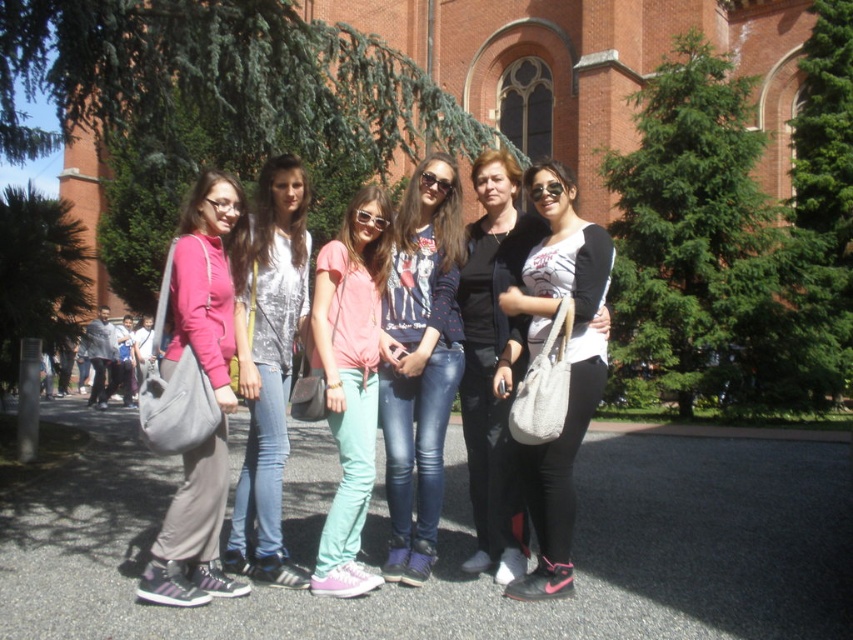
Is matte pink hoodie at left to the left of shiny silver top at center from the viewer's perspective?

Yes, matte pink hoodie at left is to the left of shiny silver top at center.

Which of these two, matte pink hoodie at left or shiny silver top at center, stands taller?

With more height is shiny silver top at center.

Between point (207, 211) and point (273, 161), which one is positioned behind?

Positioned behind is point (273, 161).

Locate an element on the screen. Image resolution: width=853 pixels, height=640 pixels. matte pink hoodie at left is located at coordinates (195, 392).

Who is higher up, shiny silver top at center or pink matte t-shirt at center?

shiny silver top at center

Between point (265, 284) and point (322, 296), which one is positioned behind?

Point (265, 284)

Image resolution: width=853 pixels, height=640 pixels. What do you see at coordinates (270, 369) in the screenshot?
I see `shiny silver top at center` at bounding box center [270, 369].

Locate an element on the screen. The width and height of the screenshot is (853, 640). shiny silver top at center is located at coordinates (270, 369).

Can you confirm if pink matte t-shirt at center is thinner than black matte jacket at center?

Yes.

Can you confirm if pink matte t-shirt at center is positioned to the right of black matte jacket at center?

In fact, pink matte t-shirt at center is to the left of black matte jacket at center.

In the scene shown: Who is more forward, (x=340, y=508) or (x=509, y=230)?

Point (x=340, y=508) is more forward.

Locate an element on the screen. pink matte t-shirt at center is located at coordinates (350, 378).